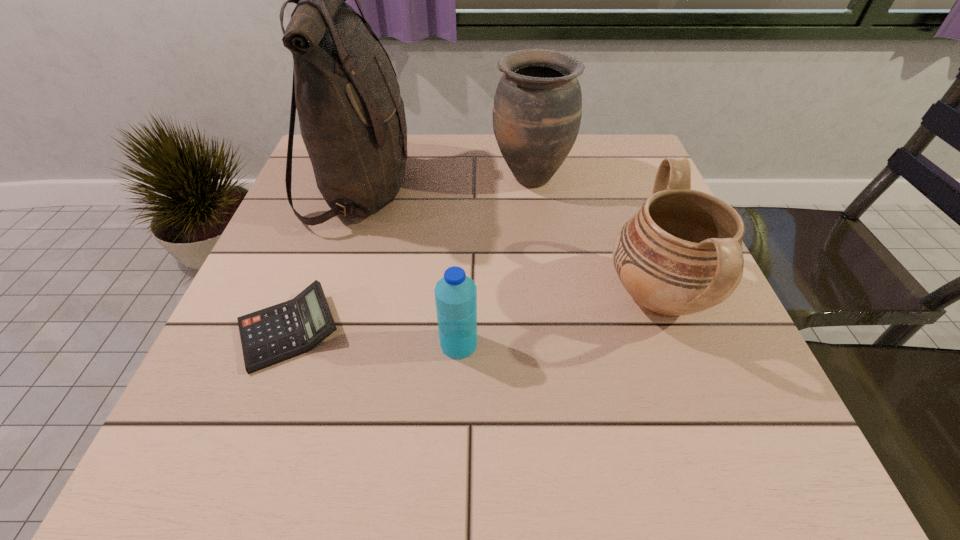
Where is `free space located on the front-facing side of the third tallest object`? Image resolution: width=960 pixels, height=540 pixels. free space located on the front-facing side of the third tallest object is located at coordinates (528, 296).

What are the coordinates of `vacant space located on the front-facing side of the third tallest object` in the screenshot? It's located at (468, 296).

Find the location of a particular element. vacant region located on the front-facing side of the third tallest object is located at coordinates (565, 296).

This screenshot has height=540, width=960. I want to click on vacant region located 0.140m on the right of the water bottle, so click(x=560, y=344).

In order to click on vacant space located on the back of the shortest object in this screenshot , I will do `click(329, 222)`.

You are a GUI agent. You are given a task and a screenshot of the screen. Output one action in this format:
    pyautogui.click(x=<x>, y=<y>)
    Task: Click on the backpack located in the far edge section of the desktop
    The width and height of the screenshot is (960, 540).
    Given the screenshot: What is the action you would take?
    pyautogui.click(x=352, y=119)

Identify the location of urn situated at the far edge. The height and width of the screenshot is (540, 960). (537, 110).

At what (x,y) coordinates should I click in order to perform the action: click on backpack situated at the left edge. Please return your answer as a coordinate pair (x, y). The image size is (960, 540). Looking at the image, I should click on (352, 119).

I want to click on calculator that is at the left edge, so click(x=283, y=331).

Identify the location of object that is positioned at the right edge. (681, 253).